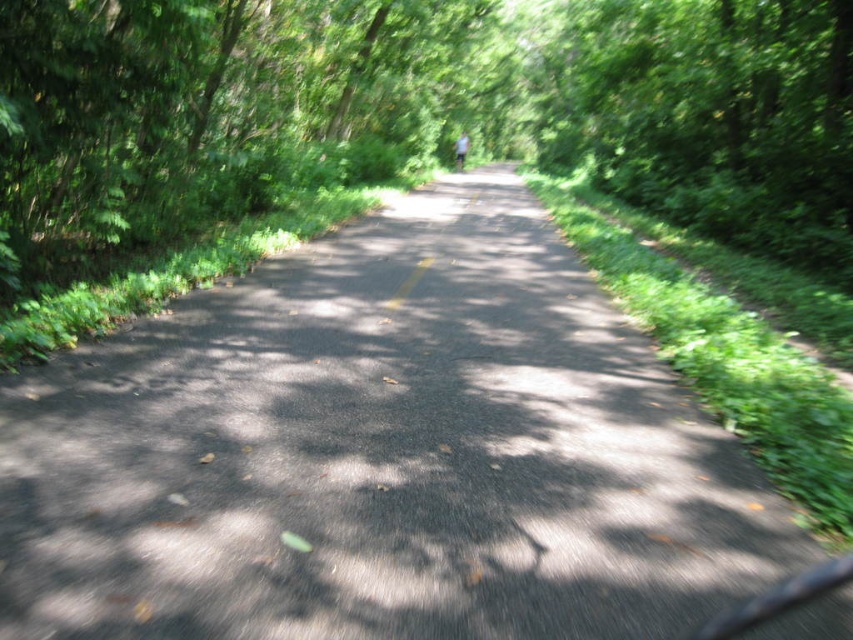
Question: Is black asphalt road at center further to the viewer compared to white cotton shirt at center?

Choices:
 (A) yes
 (B) no

Answer: (B)

Question: Does black asphalt road at center lie in front of white cotton shirt at center?

Choices:
 (A) yes
 (B) no

Answer: (A)

Question: Among these points, which one is nearest to the camera?

Choices:
 (A) (463, 150)
 (B) (494, 540)

Answer: (B)

Question: Is black asphalt road at center positioned behind white cotton shirt at center?

Choices:
 (A) no
 (B) yes

Answer: (A)

Question: Which point is closer to the camera?

Choices:
 (A) black asphalt road at center
 (B) white cotton shirt at center

Answer: (A)